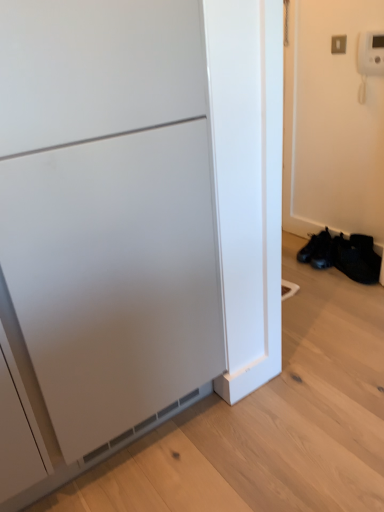
Question: Considering the relative sizes of black mesh shoe at lower right and black leather shoes at lower right in the image provided, is black mesh shoe at lower right thinner than black leather shoes at lower right?

Choices:
 (A) yes
 (B) no

Answer: (A)

Question: Is black leather shoes at lower right surrounded by black mesh shoe at lower right?

Choices:
 (A) yes
 (B) no

Answer: (B)

Question: Considering the relative sizes of black mesh shoe at lower right and black leather shoes at lower right in the image provided, is black mesh shoe at lower right shorter than black leather shoes at lower right?

Choices:
 (A) yes
 (B) no

Answer: (B)

Question: From the image's perspective, is black mesh shoe at lower right beneath black leather shoes at lower right?

Choices:
 (A) yes
 (B) no

Answer: (A)

Question: From the image's perspective, is black mesh shoe at lower right located above black leather shoes at lower right?

Choices:
 (A) no
 (B) yes

Answer: (A)

Question: Is black mesh shoe at lower right to the right of black leather shoes at lower right from the viewer's perspective?

Choices:
 (A) no
 (B) yes

Answer: (B)

Question: Does black leather shoes at lower right have a lesser width compared to matte white cabinet at left?

Choices:
 (A) yes
 (B) no

Answer: (A)

Question: From the image's perspective, is black leather shoes at lower right located beneath matte white cabinet at left?

Choices:
 (A) yes
 (B) no

Answer: (A)

Question: Does black leather shoes at lower right have a smaller size compared to matte white cabinet at left?

Choices:
 (A) no
 (B) yes

Answer: (B)

Question: Is black leather shoes at lower right bigger than matte white cabinet at left?

Choices:
 (A) no
 (B) yes

Answer: (A)

Question: Is black leather shoes at lower right in contact with matte white cabinet at left?

Choices:
 (A) yes
 (B) no

Answer: (B)

Question: Is black leather shoes at lower right not inside matte white cabinet at left?

Choices:
 (A) yes
 (B) no

Answer: (A)

Question: Is matte white cabinet at left completely or partially outside of black mesh shoe at lower right?

Choices:
 (A) no
 (B) yes

Answer: (B)